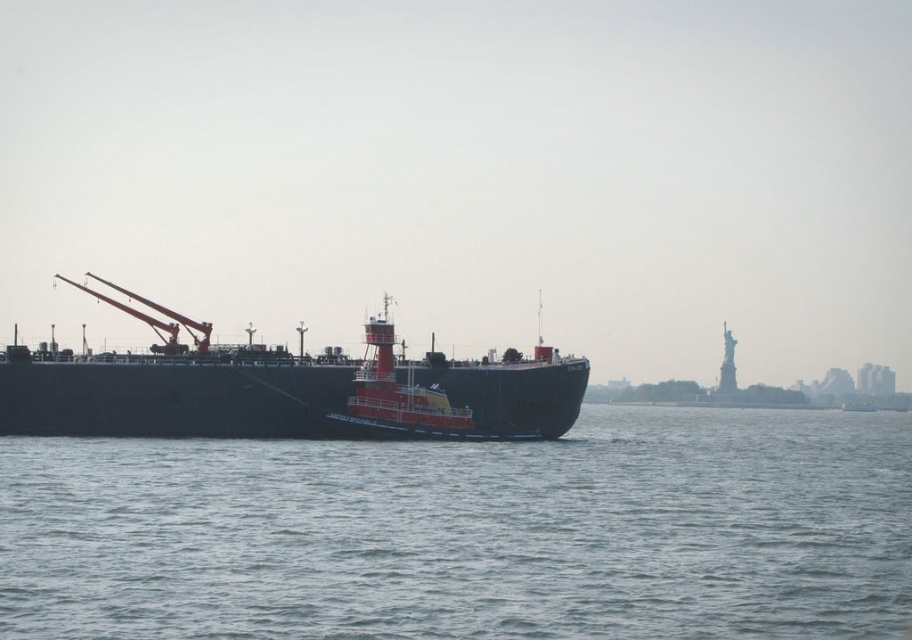
Question: Is gray water at center positioned behind matte black ship at center?

Choices:
 (A) yes
 (B) no

Answer: (B)

Question: Can you confirm if gray water at center is positioned to the right of matte black ship at center?

Choices:
 (A) no
 (B) yes

Answer: (B)

Question: Is gray water at center closer to camera compared to matte black ship at center?

Choices:
 (A) yes
 (B) no

Answer: (A)

Question: Which of the following is the farthest from the observer?

Choices:
 (A) matte black ship at center
 (B) gray water at center

Answer: (A)